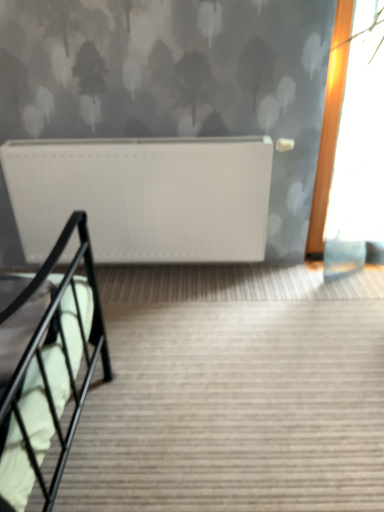
Question: Can you confirm if black metal stairs at lower left is smaller than white matte radiator at upper center?

Choices:
 (A) yes
 (B) no

Answer: (B)

Question: From the image's perspective, is black metal stairs at lower left above white matte radiator at upper center?

Choices:
 (A) yes
 (B) no

Answer: (B)

Question: Is black metal stairs at lower left oriented away from white matte radiator at upper center?

Choices:
 (A) yes
 (B) no

Answer: (B)

Question: Is black metal stairs at lower left positioned in front of white matte radiator at upper center?

Choices:
 (A) no
 (B) yes

Answer: (B)

Question: Does black metal stairs at lower left have a lesser width compared to white matte radiator at upper center?

Choices:
 (A) no
 (B) yes

Answer: (A)

Question: Does black metal stairs at lower left have a greater width compared to white matte radiator at upper center?

Choices:
 (A) no
 (B) yes

Answer: (B)

Question: Can you confirm if white matte radiator at upper center is positioned to the left of black metal stairs at lower left?

Choices:
 (A) no
 (B) yes

Answer: (B)

Question: Is white matte radiator at upper center thinner than black metal stairs at lower left?

Choices:
 (A) yes
 (B) no

Answer: (A)

Question: Is white matte radiator at upper center not inside black metal stairs at lower left?

Choices:
 (A) no
 (B) yes

Answer: (B)

Question: Is white matte radiator at upper center smaller than black metal stairs at lower left?

Choices:
 (A) yes
 (B) no

Answer: (A)

Question: Could black metal stairs at lower left be considered to be inside white matte radiator at upper center?

Choices:
 (A) no
 (B) yes

Answer: (A)

Question: Is white matte radiator at upper center oriented towards black metal stairs at lower left?

Choices:
 (A) yes
 (B) no

Answer: (A)

Question: In the image, is black metal stairs at lower left positioned in front of or behind white matte radiator at upper center?

Choices:
 (A) behind
 (B) front

Answer: (B)